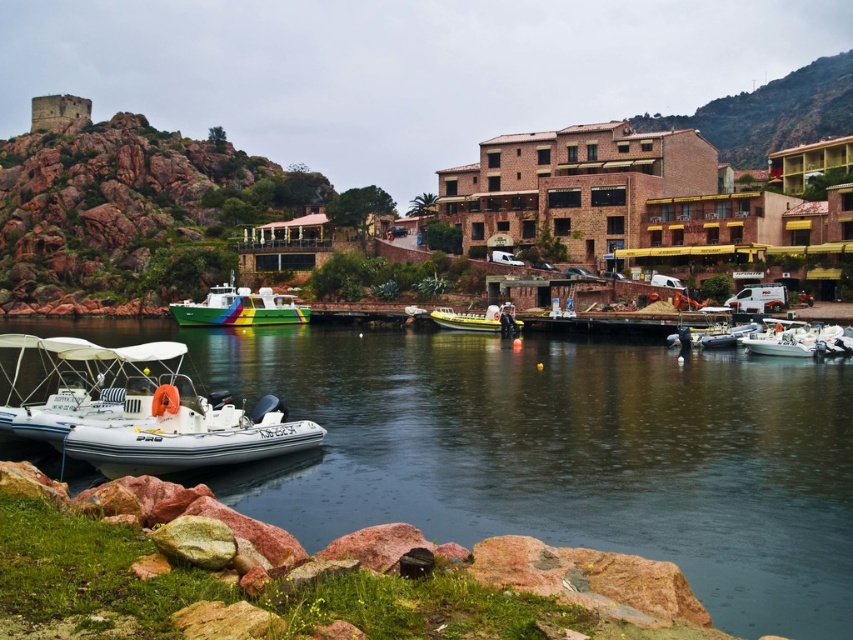
You are a photographer planning to capture the rustic stone tower at upper left and the white glossy boat at lower right in the same frame. Considering their sizes, which object should you focus on first to ensure both fit in the photo?

The rustic stone tower at upper left is bigger than the white glossy boat at lower right, so you should focus on framing the rustic stone tower at upper left first to ensure both fit in the photo.

You are a delivery drone that needs to fly from the brown brick building at upper right to the yellow rubber boat at center. Is there enough space between them for you to pass through without touching either?

The brown brick building at upper right might be wider than yellow rubber boat at center, so there may not be enough space for the drone to pass safely between them. It is recommended to choose a different route to avoid collision.